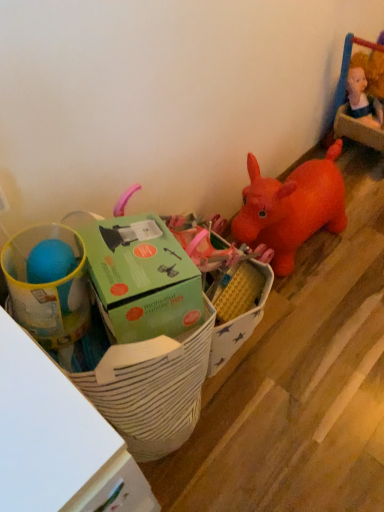
Question: Considering the positions of white striped fabric basket at lower left and matte plastic cup at left, the 2th toy positioned from the right, in the image, is white striped fabric basket at lower left taller or shorter than matte plastic cup at left, the 2th toy positioned from the right,?

Choices:
 (A) short
 (B) tall

Answer: (B)

Question: Considering their positions, is white striped fabric basket at lower left located in front of or behind matte plastic cup at left, the 2th toy positioned from the right?

Choices:
 (A) front
 (B) behind

Answer: (A)

Question: Considering the real-world distances, which object is farthest from the green cardboard box at left, which is the 2th toy from left to right?

Choices:
 (A) white striped fabric basket at lower left
 (B) matte plastic cup at left, the 2th toy positioned from the right
 (C) green cardboard box at center

Answer: (C)

Question: Which object is the farthest from the matte plastic cup at left, the 2th toy positioned from the right?

Choices:
 (A) green cardboard box at center
 (B) white striped fabric basket at lower left
 (C) green cardboard box at left, arranged as the 1th toy when viewed from the right

Answer: (A)